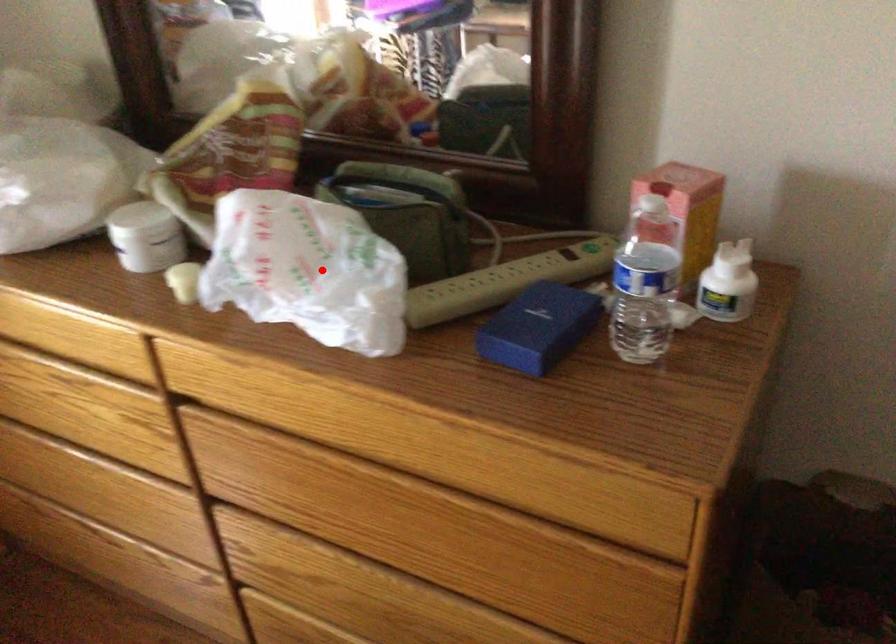
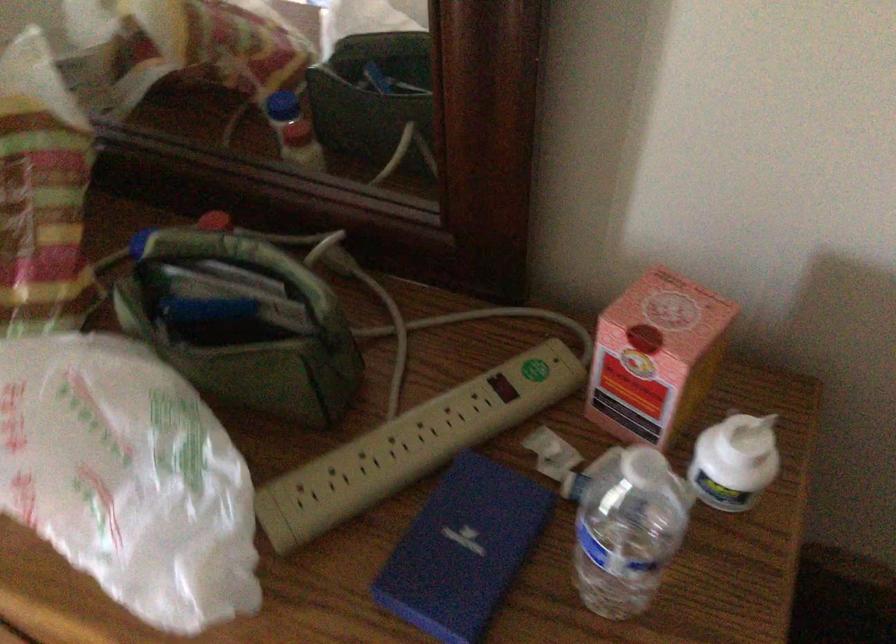
Find the pixel in the second image that matches the highlighted location in the first image.

(126, 478)